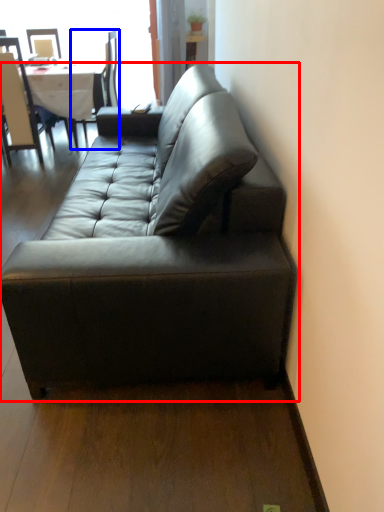
Question: Which object is closer to the camera taking this photo, studio couch (highlighted by a red box) or chair (highlighted by a blue box)?

Choices:
 (A) studio couch
 (B) chair

Answer: (A)